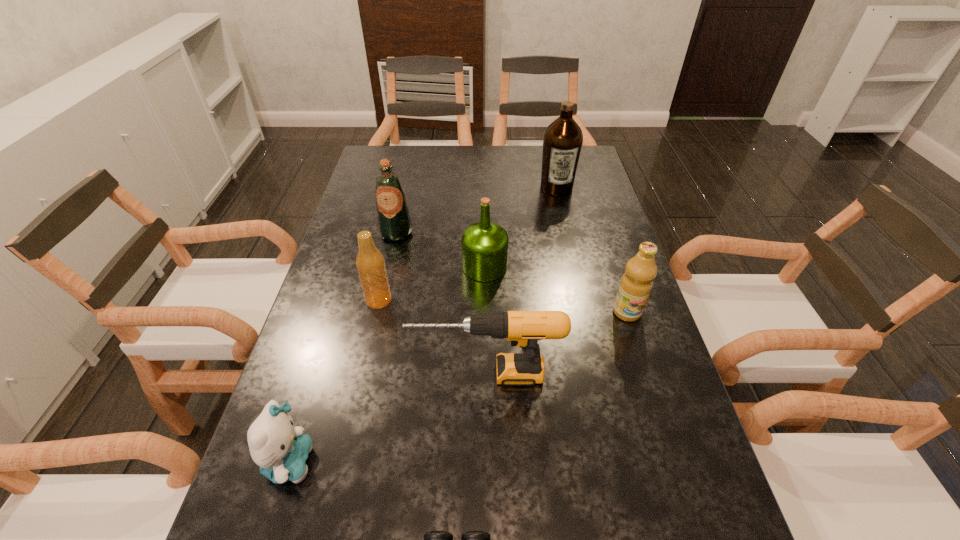
In order to click on vacant space located 0.160m on the face of the leftmost object in this screenshot , I will do `click(400, 462)`.

The image size is (960, 540). What are the coordinates of `object positioned at the far edge` in the screenshot? It's located at (562, 141).

This screenshot has width=960, height=540. In order to click on olive oil that is at the left edge in this screenshot , I will do `click(394, 222)`.

Locate an element on the screen. beer bottle that is at the left edge is located at coordinates (370, 263).

Locate an element on the screen. kitten situated at the left edge is located at coordinates (280, 450).

Locate an element on the screen. The height and width of the screenshot is (540, 960). object that is at the far right corner is located at coordinates (562, 141).

Locate an element on the screen. vacant space at the far edge of the desktop is located at coordinates (509, 154).

Identify the location of vacant space at the left edge of the desktop. (330, 282).

The image size is (960, 540). Find the location of `free space at the right edge of the desktop`. free space at the right edge of the desktop is located at coordinates (575, 246).

The height and width of the screenshot is (540, 960). In order to click on vacant area that lies between the nearest olive oil and the seventh farthest object in this screenshot , I will do `click(459, 387)`.